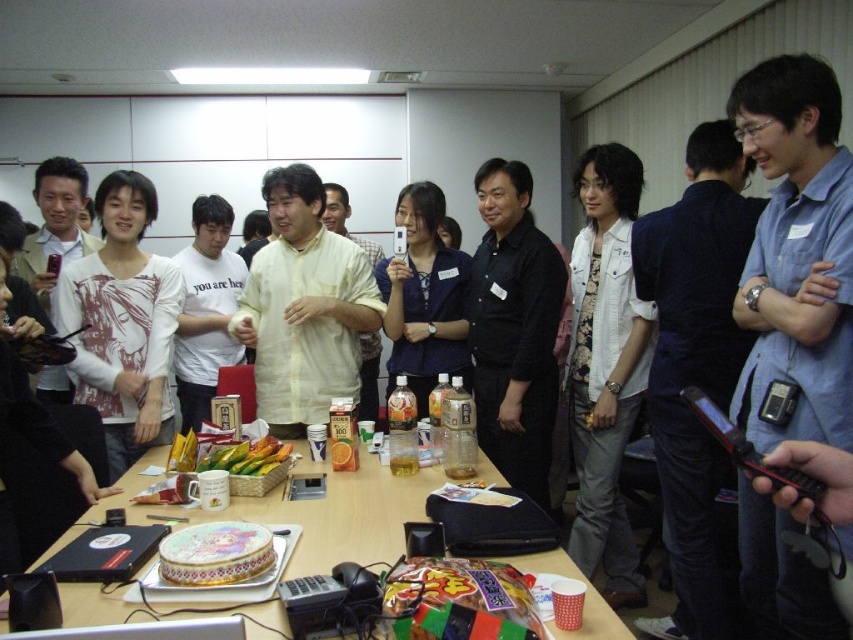
Between smooth wooden table at center and yellow matte bananas at center, which one has more height?

smooth wooden table at center

Is point (347, 545) positioned in front of point (287, 449)?

Yes, point (347, 545) is in front of point (287, 449).

The width and height of the screenshot is (853, 640). I want to click on smooth wooden table at center, so click(299, 512).

At what (x,y) coordinates should I click in order to perform the action: click on smooth wooden table at center. Please return your answer as a coordinate pair (x, y). This screenshot has width=853, height=640. Looking at the image, I should click on (299, 512).

Can you confirm if blue denim shirt at center is positioned below white matte shirt at center?

Yes.

In the scene shown: Does blue denim shirt at center come in front of white matte shirt at center?

That is True.

This screenshot has height=640, width=853. What are the coordinates of `blue denim shirt at center` in the screenshot? It's located at (795, 257).

Who is taller, blue shirt at center or matte yellow shirt at center?

blue shirt at center

How distant is blue shirt at center from matte yellow shirt at center?

blue shirt at center and matte yellow shirt at center are 2.02 meters apart from each other.

At what (x,y) coordinates should I click in order to perform the action: click on blue shirt at center. Please return your answer as a coordinate pair (x, y). The width and height of the screenshot is (853, 640). Looking at the image, I should click on (695, 364).

At what (x,y) coordinates should I click in order to perform the action: click on blue shirt at center. Please return your answer as a coordinate pair (x, y). The image size is (853, 640). Looking at the image, I should click on (695, 364).